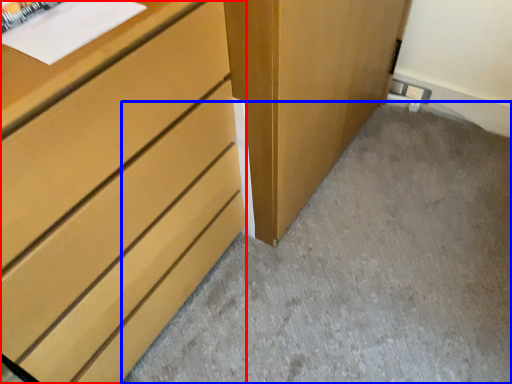
Question: Which object appears farthest to the camera in this image, chest of drawers (highlighted by a red box) or concrete (highlighted by a blue box)?

Choices:
 (A) chest of drawers
 (B) concrete

Answer: (B)